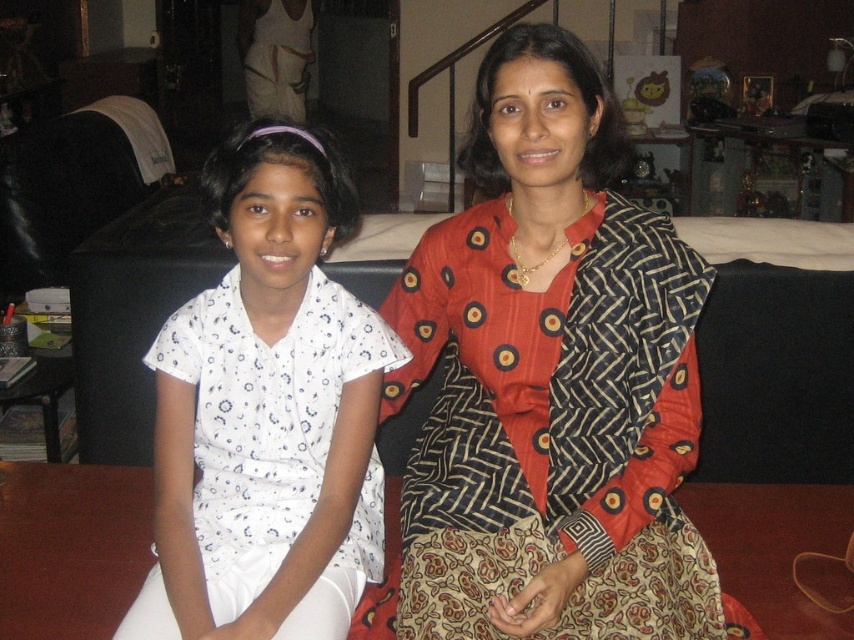
Is red printed sari at center above white printed blouse at left?

Correct, red printed sari at center is located above white printed blouse at left.

Does red printed sari at center appear on the right side of white printed blouse at left?

Indeed, red printed sari at center is positioned on the right side of white printed blouse at left.

Who is more forward, (442, 221) or (295, 484)?

Point (295, 484) is in front.

Locate an element on the screen. This screenshot has height=640, width=854. red printed sari at center is located at coordinates 550,380.